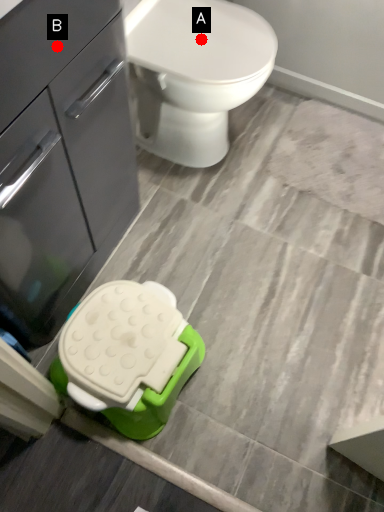
Question: Two points are circled on the image, labeled by A and B beside each circle. Which point is closer to the camera taking this photo?

Choices:
 (A) A is closer
 (B) B is closer

Answer: (B)